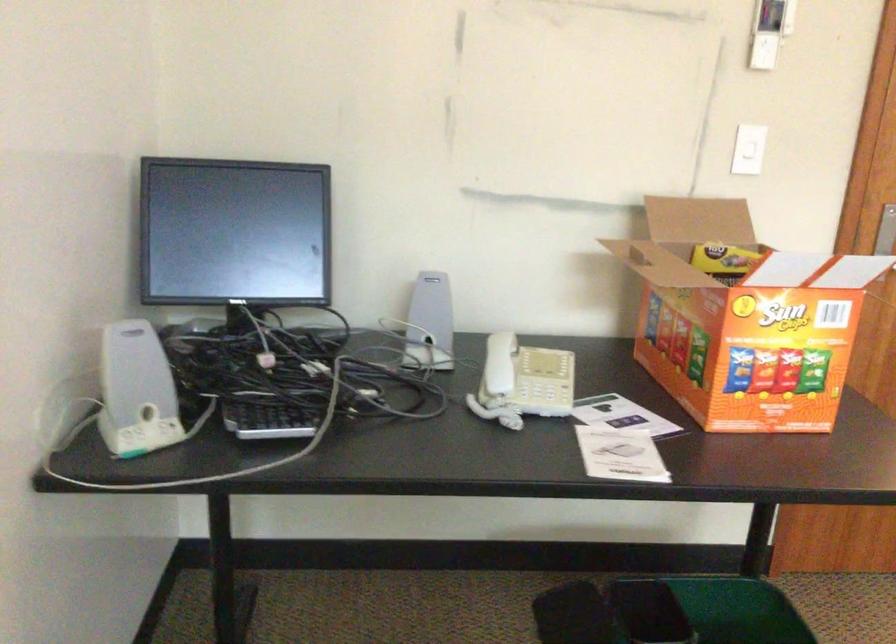
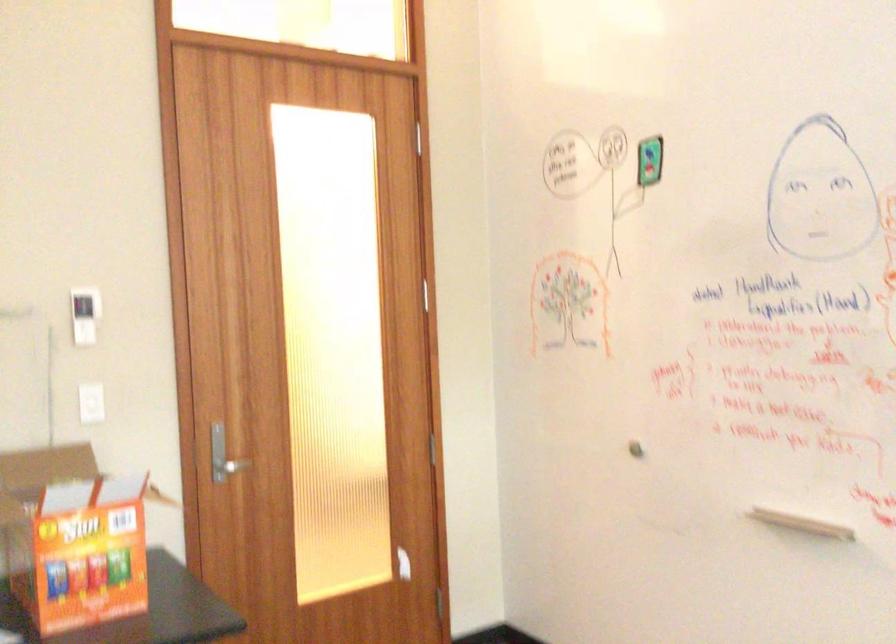
Question: The images are taken continuously from a first-person perspective. In which direction is your viewpoint rotating?

Choices:
 (A) Left
 (B) Right
 (C) Up
 (D) Down

Answer: (B)